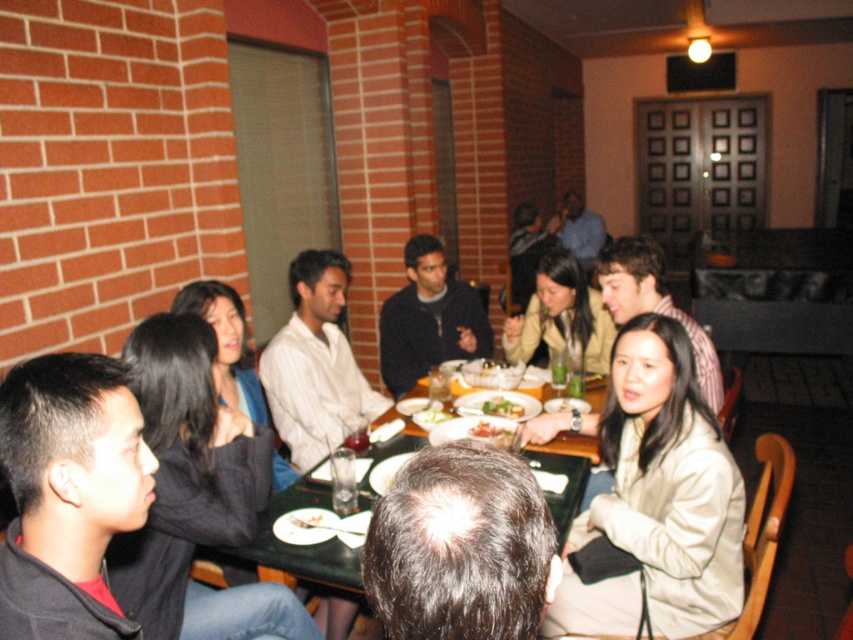
You are standing at the point marked as point (509,412) in the image. You want to take a photo of the group at the dining table using a camera with a 50mm lens. The camera requires a minimum distance of 2 meters to focus properly. Can you take a clear photo of the group from your current position?

The distance between point (509,412) and the camera is 2.65 meters, which is greater than the minimum required 2 meters. Therefore, you can take a clear photo of the group from your current position.

You are a waiter in a restaurant and need to place a napkin between the matte plastic fork at center and the green leafy salad at center. Where should you position the napkin relative to the salad?

The napkin should be placed to the right of the green leafy salad at center since the matte plastic fork at center is already positioned to its right.

In the scene shown: You are a waiter holding a tray of drinks and need to place them on the table. You are currently standing 10 feet away from the matte plastic fork at center. Can you reach the table without moving closer?

The matte plastic fork at center is 7.54 feet away from the viewer. Since you are standing 10 feet away from it, the table is farther than your reach. You need to move closer to place the drinks.